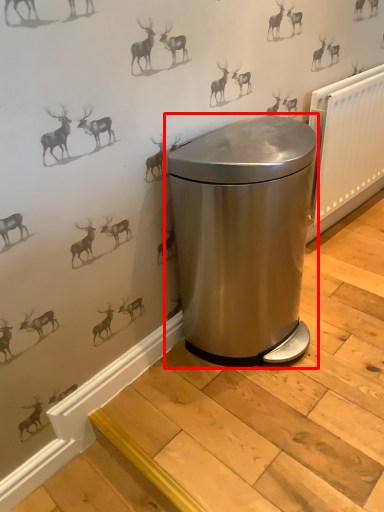
Question: In this image, where is waste container (annotated by the red box) located relative to radiator?

Choices:
 (A) left
 (B) right

Answer: (A)